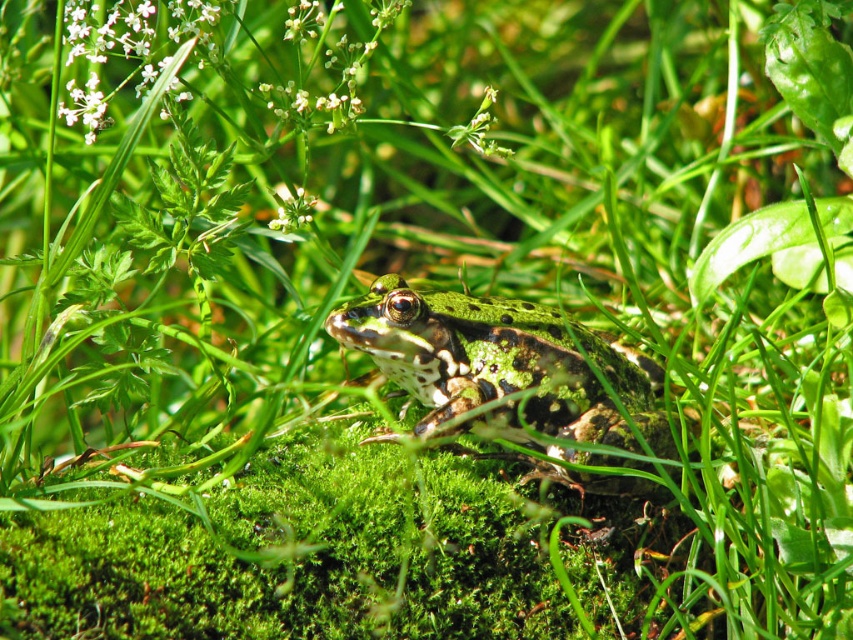
You are a gardener looking at the image. You need to water both the white fluffy flower at upper left and the green matte flower at upper center. Which flower should you water first if you want to reach the one closer to you first?

The white fluffy flower at upper left should be watered first because it is in front of the green matte flower at upper center, making it closer to you.